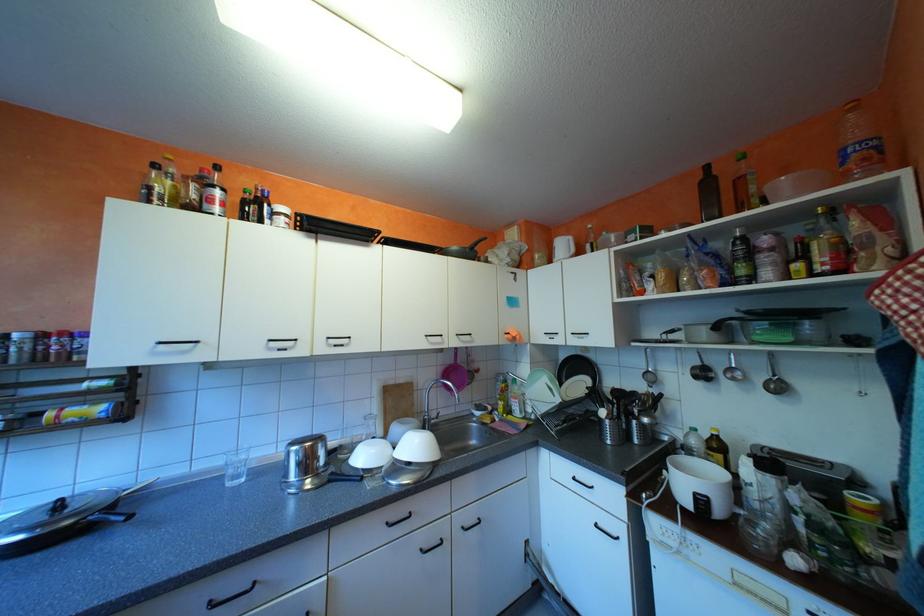
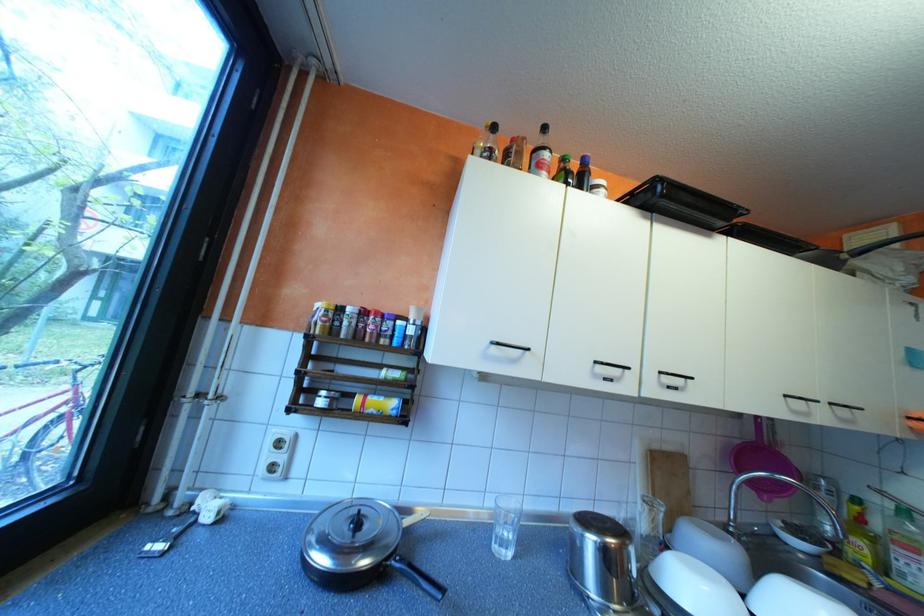
Locate, in the second image, the point that corresponds to pixel 438 334 in the first image.

(797, 395)